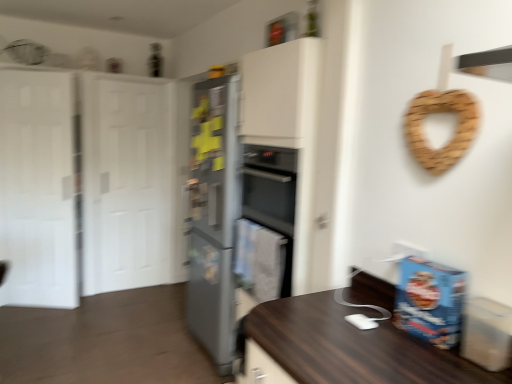
Based on the photo, measure the distance between point [231,156] and camera.

Point [231,156] and camera are 8.28 feet apart.

The width and height of the screenshot is (512, 384). What do you see at coordinates (125, 182) in the screenshot? I see `white glossy door at left, which is the first glass door in right-to-left order` at bounding box center [125, 182].

Measure the distance between point (165,113) and camera.

Point (165,113) is 4.08 meters away from camera.

What are the coordinates of `satin silver refrigerator at center` in the screenshot? It's located at (213, 215).

Which of these two, satin silver refrigerator at center or white glossy door at left, which is the first glass door in right-to-left order, is smaller?

With smaller size is white glossy door at left, which is the first glass door in right-to-left order.

From a real-world perspective, between satin silver refrigerator at center and white glossy door at left, which ranks as the 2th glass door in front-to-back order, who is vertically lower?

In real-world perspective, satin silver refrigerator at center is lower.

Is satin silver refrigerator at center positioned far away from white glossy door at left, the first glass door in the back-to-front sequence?

satin silver refrigerator at center is positioned a significant distance from white glossy door at left, the first glass door in the back-to-front sequence.

Is point (199, 216) closer or farther from the camera than point (111, 190)?

Clearly, point (199, 216) is closer to the camera than point (111, 190).

Which is more to the right, white glossy door at left, which ranks as the 2th glass door in back-to-front order, or satin silver refrigerator at center?

From the viewer's perspective, satin silver refrigerator at center appears more on the right side.

Can you tell me how much white glossy door at left, the 1th glass door in the left-to-right sequence, and satin silver refrigerator at center differ in facing direction?

There is a 60.4-degree angle between the facing directions of white glossy door at left, the 1th glass door in the left-to-right sequence, and satin silver refrigerator at center.

From the image's perspective, who appears lower, white glossy door at left, arranged as the 2th glass door when viewed from the right, or satin silver refrigerator at center?

satin silver refrigerator at center, from the image's perspective.

Who is shorter, white glossy door at left, which ranks as the 2th glass door in back-to-front order, or satin silver refrigerator at center?

satin silver refrigerator at center.

Are white matte door at left and white glossy door at left, acting as the 1th glass door starting from the front, beside each other?

white matte door at left and white glossy door at left, acting as the 1th glass door starting from the front, are not in contact.

Is the depth of white matte door at left less than that of white glossy door at left, acting as the 1th glass door starting from the front?

Yes, white matte door at left is closer to the camera.

Measure the distance from white matte door at left to white glossy door at left, acting as the 1th glass door starting from the front.

white matte door at left is 9.93 inches from white glossy door at left, acting as the 1th glass door starting from the front.

Between point (41, 104) and point (18, 280), which one is positioned behind?

Positioned behind is point (18, 280).

Is white glossy door at left, the 2th glass door in the left-to-right sequence, to the left of white glossy door at left, arranged as the 2th glass door when viewed from the right, from the viewer's perspective?

In fact, white glossy door at left, the 2th glass door in the left-to-right sequence, is to the right of white glossy door at left, arranged as the 2th glass door when viewed from the right.

From a real-world perspective, is white glossy door at left, the first glass door in the back-to-front sequence, located beneath white glossy door at left, the 1th glass door in the left-to-right sequence?

Yes, from a real-world perspective, white glossy door at left, the first glass door in the back-to-front sequence, is below white glossy door at left, the 1th glass door in the left-to-right sequence.

Which object is further away from the camera taking this photo, white glossy door at left, which is the first glass door in right-to-left order, or white glossy door at left, acting as the 1th glass door starting from the front?

white glossy door at left, which is the first glass door in right-to-left order.

Is white glossy door at left, which ranks as the 2th glass door in front-to-back order, wider than white glossy door at left, the 1th glass door in the left-to-right sequence?

Correct, the width of white glossy door at left, which ranks as the 2th glass door in front-to-back order, exceeds that of white glossy door at left, the 1th glass door in the left-to-right sequence.

Are white glossy door at left, arranged as the 2th glass door when viewed from the right, and white matte door at left making contact?

No.

Consider the image. Is white glossy door at left, the 1th glass door in the left-to-right sequence, spatially inside white matte door at left, or outside of it?

The correct answer is: outside.

Which of these two, white glossy door at left, the 1th glass door in the left-to-right sequence, or white matte door at left, is wider?

white matte door at left is wider.

Is white glossy door at left, acting as the 1th glass door starting from the front, oriented away from white matte door at left?

Yes, white glossy door at left, acting as the 1th glass door starting from the front, is positioned with its back facing white matte door at left.

Is white glossy door at left, which is the first glass door in right-to-left order, turned away from white matte door at left?

Absolutely, white glossy door at left, which is the first glass door in right-to-left order, is directed away from white matte door at left.

Is point (145, 271) closer to camera compared to point (70, 131)?

No, it is behind (70, 131).

Which object is thinner, white glossy door at left, which is the first glass door in right-to-left order, or white matte door at left?

Thinner between the two is white glossy door at left, which is the first glass door in right-to-left order.

Locate an element on the screen. The width and height of the screenshot is (512, 384). the 2nd glass door behind the white matte door at left, starting your count from the anchor is located at coordinates (125, 182).

How much distance is there between white matte door at left and satin silver refrigerator at center?

white matte door at left is 4.12 feet away from satin silver refrigerator at center.

Is white matte door at left facing towards satin silver refrigerator at center?

Yes, white matte door at left is oriented towards satin silver refrigerator at center.

Considering the sizes of objects white matte door at left and satin silver refrigerator at center in the image provided, who is bigger, white matte door at left or satin silver refrigerator at center?

Bigger between the two is white matte door at left.

Based on the photo, does white matte door at left have a greater height compared to satin silver refrigerator at center?

Yes, white matte door at left is taller than satin silver refrigerator at center.

The width and height of the screenshot is (512, 384). What are the coordinates of `refrigerator in front of the white glossy door at left, the first glass door in the back-to-front sequence` in the screenshot? It's located at (213, 215).

Image resolution: width=512 pixels, height=384 pixels. I want to click on refrigerator below the white glossy door at left, acting as the 1th glass door starting from the front (from a real-world perspective), so click(213, 215).

Based on their spatial positions, is white glossy door at left, the 2th glass door in the left-to-right sequence, or satin silver refrigerator at center closer to white glossy door at left, arranged as the 2th glass door when viewed from the right?

Based on the image, white glossy door at left, the 2th glass door in the left-to-right sequence, appears to be nearer to white glossy door at left, arranged as the 2th glass door when viewed from the right.

When comparing their distances from white glossy door at left, which ranks as the 2th glass door in front-to-back order, does white glossy door at left, arranged as the 2th glass door when viewed from the right, or satin silver refrigerator at center seem closer?

white glossy door at left, arranged as the 2th glass door when viewed from the right, is positioned closer to the anchor white glossy door at left, which ranks as the 2th glass door in front-to-back order.

Which object lies further to the anchor point satin silver refrigerator at center, white glossy door at left, the 2th glass door in the left-to-right sequence, or white glossy door at left, acting as the 1th glass door starting from the front?

white glossy door at left, acting as the 1th glass door starting from the front, lies further to satin silver refrigerator at center than the other object.

Estimate the real-world distances between objects in this image. Which object is further from satin silver refrigerator at center, white matte door at left or white glossy door at left, the 2th glass door in the left-to-right sequence?

Among the two, white matte door at left is located further to satin silver refrigerator at center.

From the picture: Which object lies further to the anchor point white matte door at left, white glossy door at left, which is the first glass door in right-to-left order, or satin silver refrigerator at center?

Based on the image, satin silver refrigerator at center appears to be further to white matte door at left.

Considering their positions, is white matte door at left positioned further to white glossy door at left, the first glass door in the back-to-front sequence, than satin silver refrigerator at center?

satin silver refrigerator at center is further to white glossy door at left, the first glass door in the back-to-front sequence.

Based on their spatial positions, is white glossy door at left, which ranks as the 2th glass door in back-to-front order, or white glossy door at left, the first glass door in the back-to-front sequence, further from white matte door at left?

The object further to white matte door at left is white glossy door at left, which ranks as the 2th glass door in back-to-front order.

Considering their positions, is white glossy door at left, which ranks as the 2th glass door in front-to-back order, positioned further to white glossy door at left, the 1th glass door in the left-to-right sequence, than white matte door at left?

Among the two, white glossy door at left, which ranks as the 2th glass door in front-to-back order, is located further to white glossy door at left, the 1th glass door in the left-to-right sequence.

Find the location of a particular element. door located between white glossy door at left, which ranks as the 2th glass door in back-to-front order, and satin silver refrigerator at center in the left-right direction is located at coordinates (86, 184).

The height and width of the screenshot is (384, 512). I want to click on door between white glossy door at left, arranged as the 2th glass door when viewed from the right, and white glossy door at left, the first glass door in the back-to-front sequence, in the horizontal direction, so click(86, 184).

Locate an element on the screen. glass door between white glossy door at left, which ranks as the 2th glass door in back-to-front order, and satin silver refrigerator at center is located at coordinates (125, 182).

This screenshot has width=512, height=384. In order to click on glass door between white matte door at left and satin silver refrigerator at center from left to right in this screenshot , I will do `click(125, 182)`.